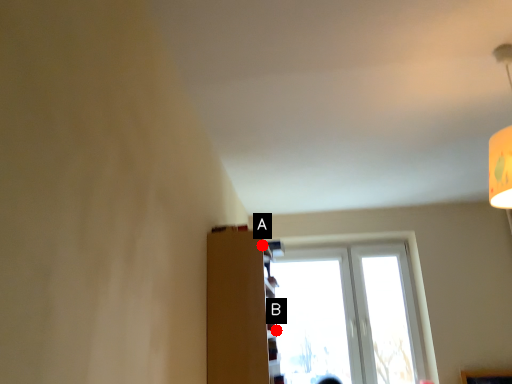
Question: Two points are circled on the image, labeled by A and B beside each circle. Which point is farther from the camera taking this photo?

Choices:
 (A) A is further
 (B) B is further

Answer: (B)